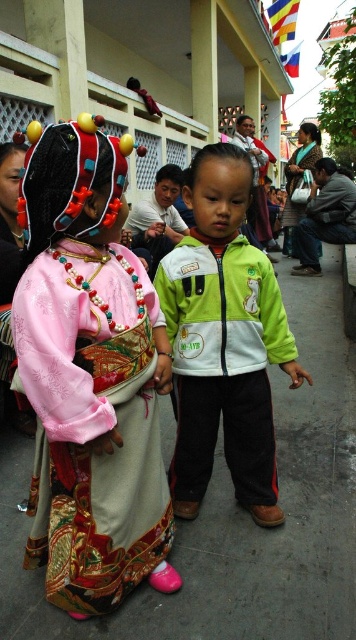
Can you confirm if matte pink fabric dress at left is bigger than dark gray fabric jacket at right?

Incorrect, matte pink fabric dress at left is not larger than dark gray fabric jacket at right.

Between matte pink fabric dress at left and dark gray fabric jacket at right, which one appears on the left side from the viewer's perspective?

matte pink fabric dress at left

Does point (133, 275) come closer to viewer compared to point (344, 211)?

Yes, point (133, 275) is in front of point (344, 211).

Where is `matte pink fabric dress at left`? This screenshot has height=640, width=356. matte pink fabric dress at left is located at coordinates (90, 378).

The width and height of the screenshot is (356, 640). Describe the element at coordinates (223, 340) in the screenshot. I see `green matte jacket at center` at that location.

Find the location of a particular element. This screenshot has width=356, height=640. green matte jacket at center is located at coordinates (223, 340).

Is dark gray fabric jacket at right to the left of white matte jacket at center from the viewer's perspective?

No, dark gray fabric jacket at right is not to the left of white matte jacket at center.

Where is `dark gray fabric jacket at right`? This screenshot has width=356, height=640. dark gray fabric jacket at right is located at coordinates (325, 216).